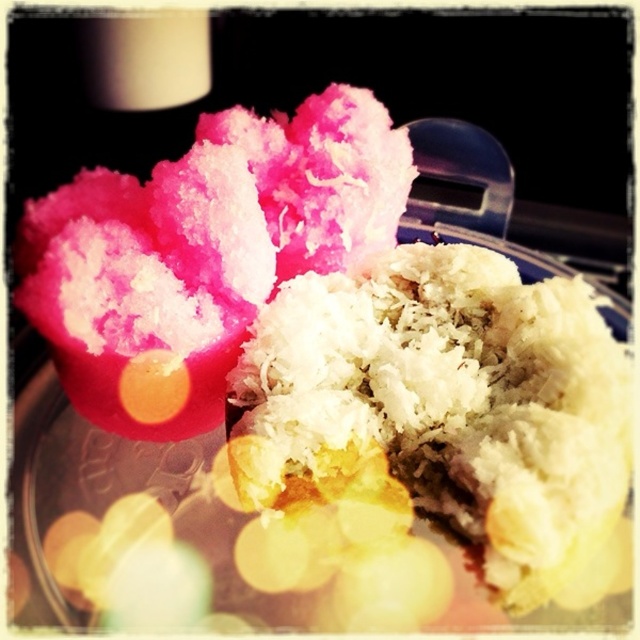
Is point (420, 340) positioned in front of point (232, 140)?

Yes.

Does white shredded rice at center have a lesser width compared to pink fluffy cotton candy at upper left?

Yes.

Between point (433, 342) and point (152, 232), which one is positioned in front?

Point (433, 342) is more forward.

This screenshot has width=640, height=640. What are the coordinates of `white shredded rice at center` in the screenshot? It's located at (448, 404).